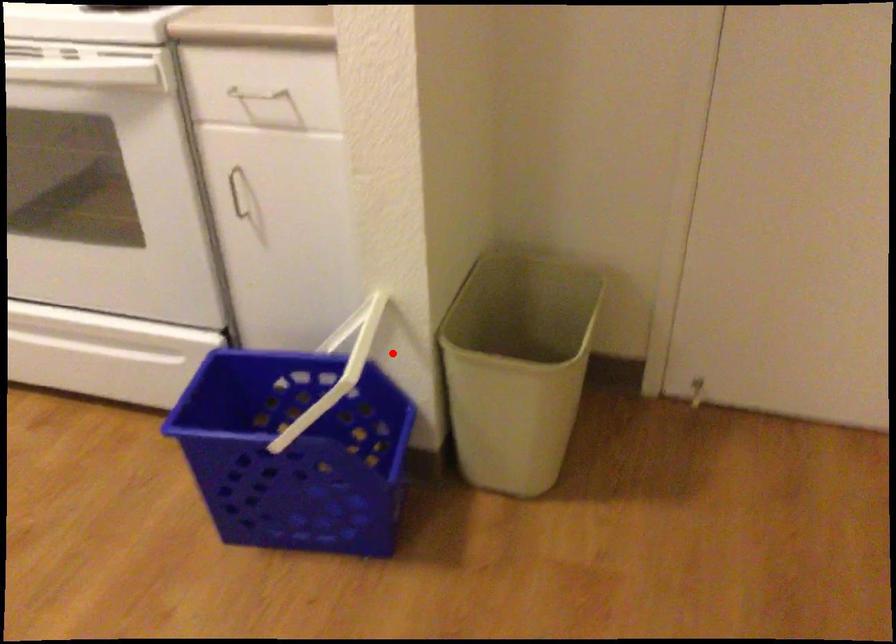
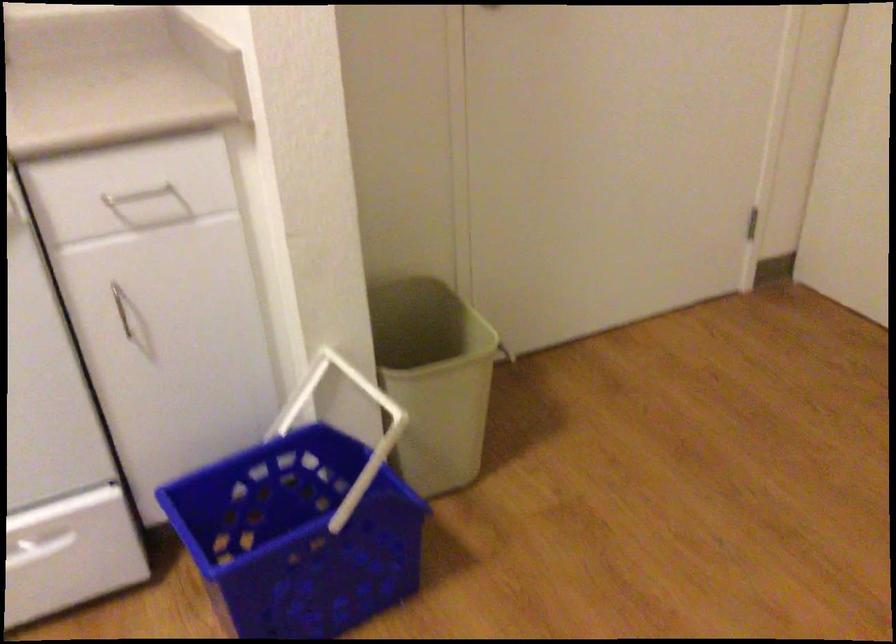
The point at the highlighted location is marked in the first image. Where is the corresponding point in the second image?

(343, 402)